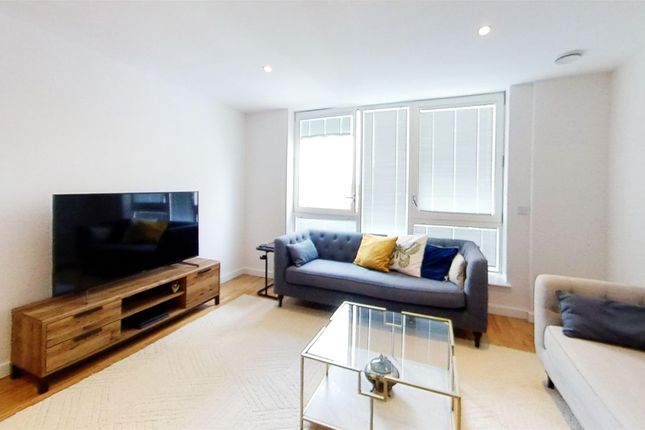
Where is `pillows`? pillows is located at coordinates (373, 248), (407, 254), (444, 257), (459, 271), (297, 253), (606, 317).